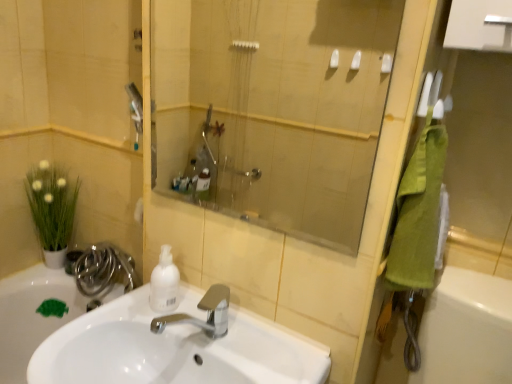
At what (x,y) coordinates should I click in order to perform the action: click on empty space that is to the right of white matte bottle at center. Please return your answer as a coordinate pair (x, y). Looking at the image, I should click on (227, 330).